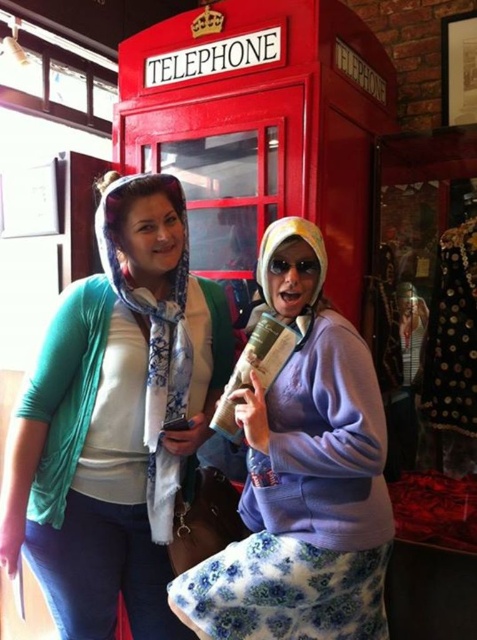
Question: Is matte blue scarf at center thinner than purple fleece jacket at center?

Choices:
 (A) no
 (B) yes

Answer: (A)

Question: Does matte blue scarf at center have a larger size compared to purple fleece jacket at center?

Choices:
 (A) no
 (B) yes

Answer: (B)

Question: Can you confirm if matte blue scarf at center is positioned below purple fleece jacket at center?

Choices:
 (A) yes
 (B) no

Answer: (B)

Question: Which object appears farthest from the camera in this image?

Choices:
 (A) matte blue scarf at center
 (B) purple fleece jacket at center

Answer: (A)

Question: Among these points, which one is nearest to the camera?

Choices:
 (A) (28, 524)
 (B) (279, 474)

Answer: (B)